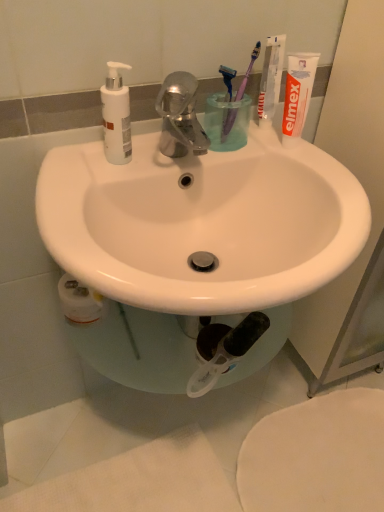
Where is `free space in front of white matte tube of toothpaste at upper right, the first toothpaste when ordered from right to left`? free space in front of white matte tube of toothpaste at upper right, the first toothpaste when ordered from right to left is located at coordinates (327, 178).